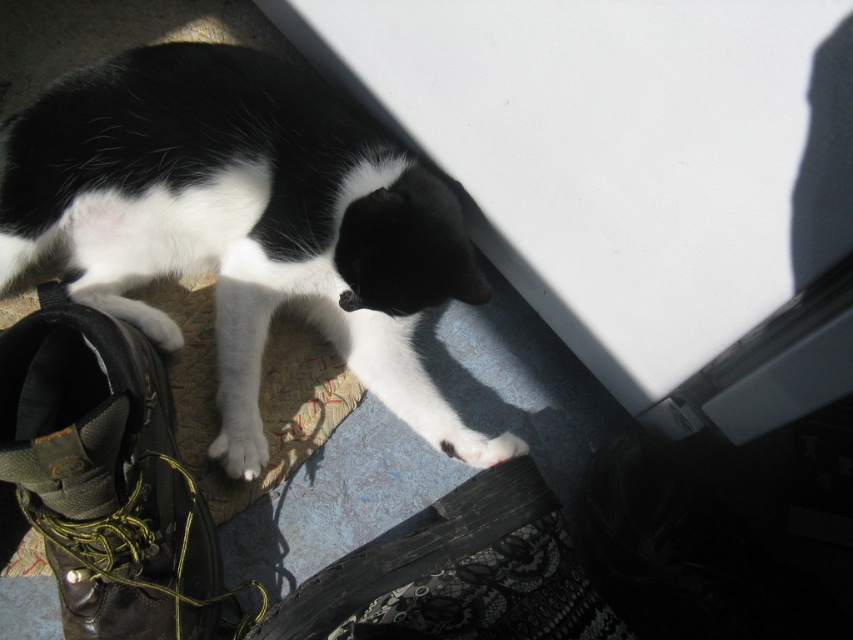
Question: Considering the real-world distances, which object is farthest from the white soft fur paw at lower left?

Choices:
 (A) leather boot at lower left
 (B) black and white fur cat at lower left

Answer: (A)

Question: Which of these objects is positioned farthest from the leather boot at lower left?

Choices:
 (A) white soft fur paw at lower left
 (B) black and white fur cat at lower left

Answer: (B)

Question: Is leather boot at lower left to the left of white soft fur paw at lower left from the viewer's perspective?

Choices:
 (A) yes
 (B) no

Answer: (A)

Question: Does leather boot at lower left appear on the left side of white soft fur paw at lower left?

Choices:
 (A) yes
 (B) no

Answer: (A)

Question: Which object is closer to the camera taking this photo?

Choices:
 (A) black and white fur cat at lower left
 (B) white soft fur paw at lower left

Answer: (A)

Question: Does black and white fur cat at lower left appear under white soft fur paw at lower left?

Choices:
 (A) no
 (B) yes

Answer: (A)